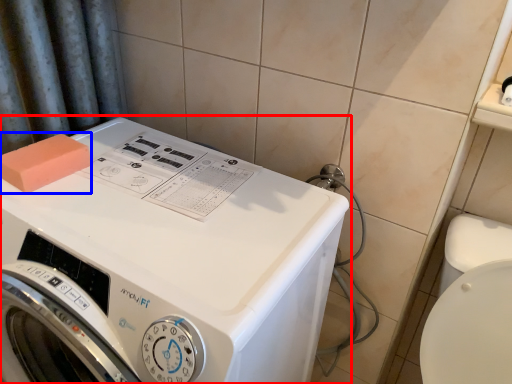
Question: Which object is closer to the camera taking this photo, washing machine (highlighted by a red box) or soap (highlighted by a blue box)?

Choices:
 (A) washing machine
 (B) soap

Answer: (A)